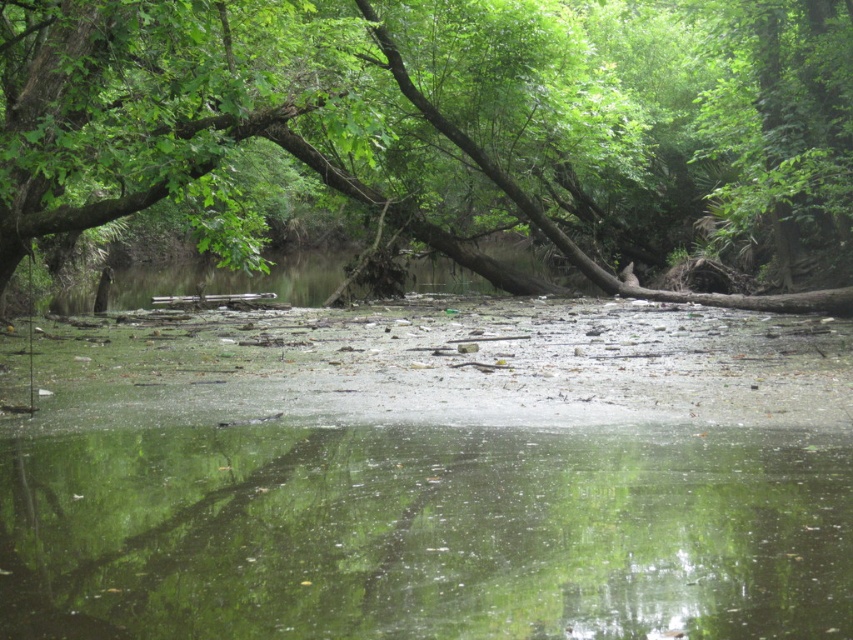
Question: Which point is closer to the camera taking this photo?

Choices:
 (A) (334, 36)
 (B) (631, 628)

Answer: (B)

Question: Can you confirm if green leafy tree at center is positioned to the left of transparent water at center?

Choices:
 (A) yes
 (B) no

Answer: (A)

Question: Is green leafy tree at center thinner than transparent water at center?

Choices:
 (A) no
 (B) yes

Answer: (A)

Question: Among these points, which one is farthest from the camera?

Choices:
 (A) (714, 483)
 (B) (357, 20)

Answer: (B)

Question: From the image, what is the correct spatial relationship of green leafy tree at center in relation to transparent water at center?

Choices:
 (A) above
 (B) below

Answer: (A)